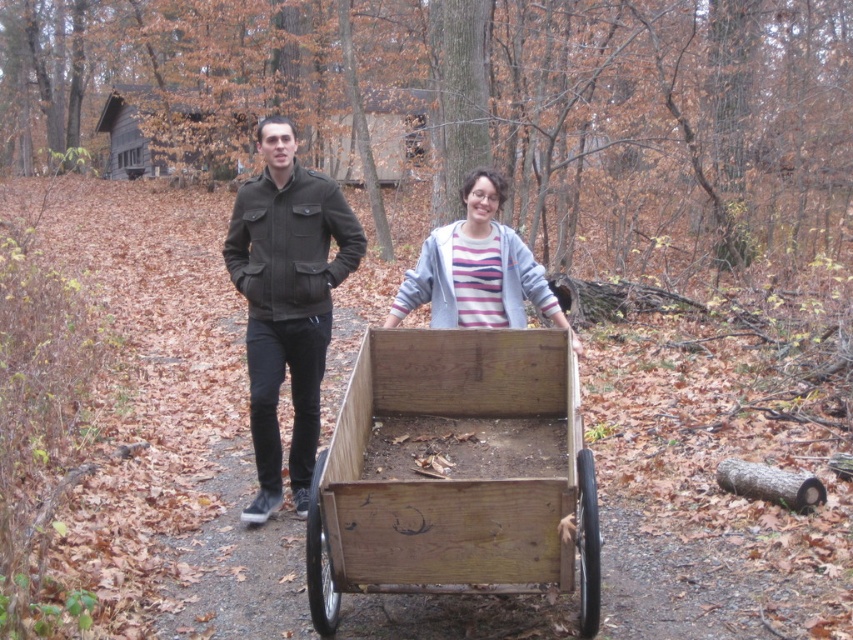
Question: Can you confirm if wooden wagon at center is positioned above striped cotton hoodie at center?

Choices:
 (A) no
 (B) yes

Answer: (A)

Question: Can you confirm if wooden wagon at center is positioned below striped cotton hoodie at center?

Choices:
 (A) yes
 (B) no

Answer: (A)

Question: Among these points, which one is farthest from the camera?

Choices:
 (A) (473, 440)
 (B) (434, 307)
 (C) (322, 248)

Answer: (B)

Question: From the image, what is the correct spatial relationship of dark olive-green jacket at center in relation to striped cotton hoodie at center?

Choices:
 (A) right
 (B) left

Answer: (B)

Question: Which point is farther from the camera taking this photo?

Choices:
 (A) (490, 460)
 (B) (483, 176)

Answer: (B)

Question: Among these objects, which one is nearest to the camera?

Choices:
 (A) striped cotton hoodie at center
 (B) dark olive-green jacket at center
 (C) wooden wagon at center

Answer: (C)